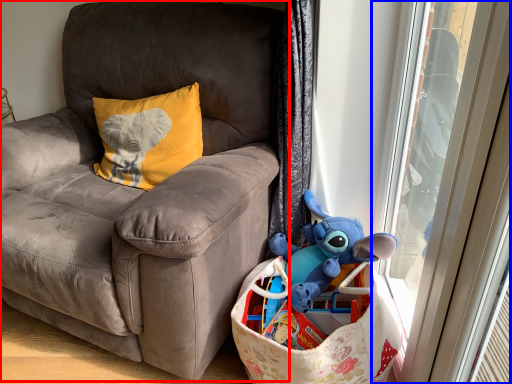
Question: Which object is further to the camera taking this photo, chair (highlighted by a red box) or screen door (highlighted by a blue box)?

Choices:
 (A) chair
 (B) screen door

Answer: (B)